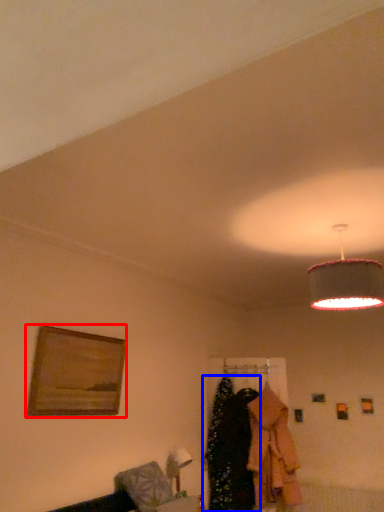
Question: Which object appears farthest to the camera in this image, picture frame (highlighted by a red box) or clothing (highlighted by a blue box)?

Choices:
 (A) picture frame
 (B) clothing

Answer: (B)